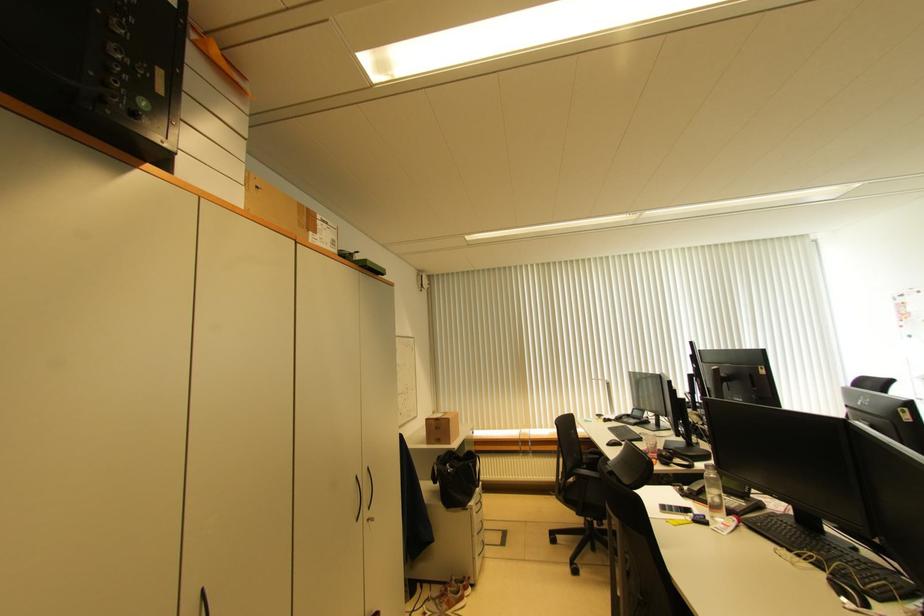
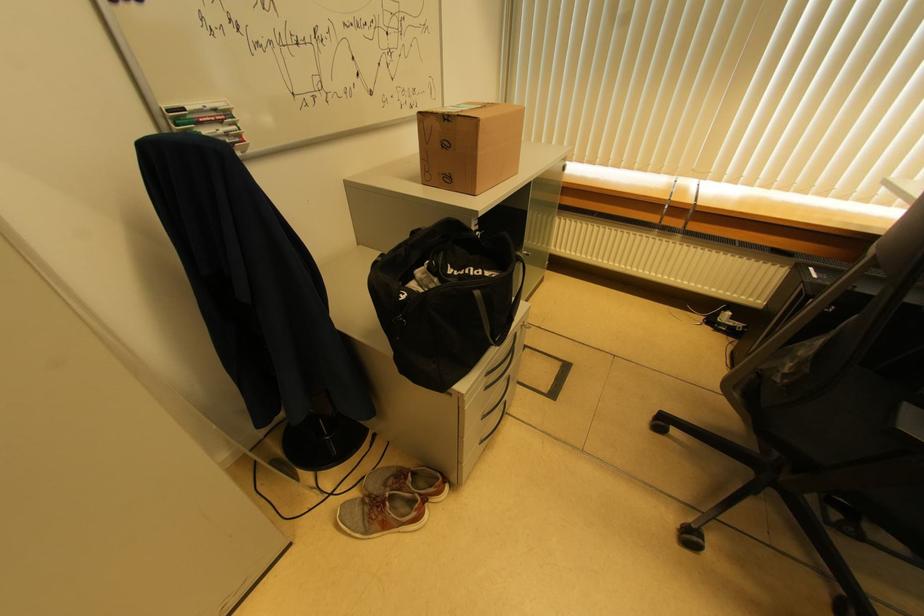
Find the pixel in the second image that matches pixel 480 537 in the first image.

(485, 419)